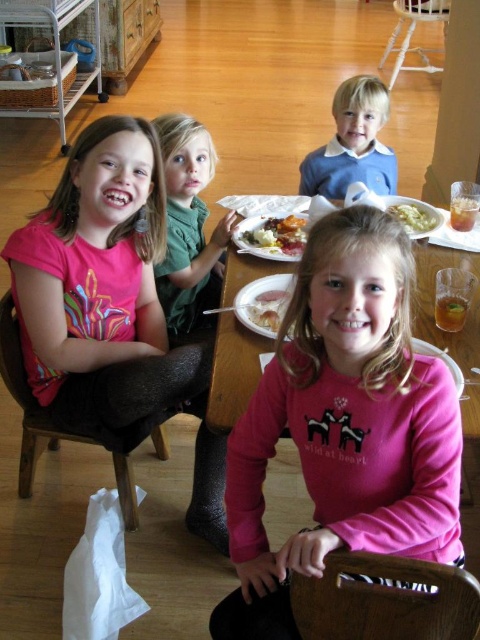
Question: Which point appears farthest from the camera in this image?

Choices:
 (A) (421, 209)
 (B) (319, 186)

Answer: (B)

Question: Which object appears farthest from the camera in this image?

Choices:
 (A) white plastic chair at upper center
 (B) slightly browned bread at center

Answer: (A)

Question: Is brown fabric chair at lower left to the right of white creamy food at center from the viewer's perspective?

Choices:
 (A) no
 (B) yes

Answer: (A)

Question: Does blue wool sweater at upper center appear under brown fabric chair at lower left?

Choices:
 (A) no
 (B) yes

Answer: (A)

Question: Can you confirm if pink glitter leggings at center is bigger than green matte shirt at upper center?

Choices:
 (A) no
 (B) yes

Answer: (B)

Question: Based on their relative distances, which object is nearer to the white creamy mashed potato at center?

Choices:
 (A) brown wood chair at lower center
 (B) pink glitter leggings at center
 (C) slightly browned bread at center

Answer: (C)